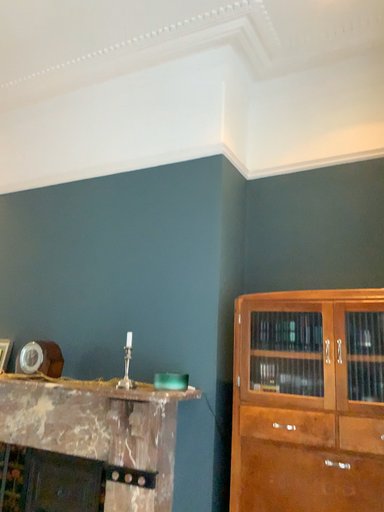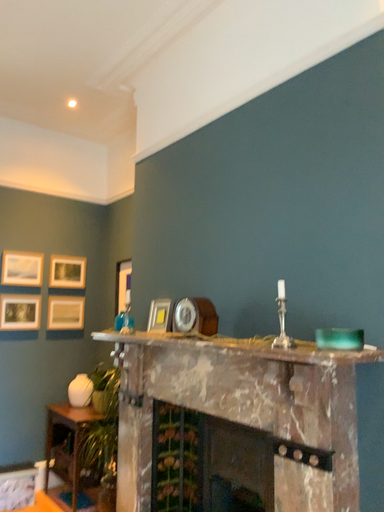
Question: Which way did the camera rotate in the video?

Choices:
 (A) rotated right
 (B) rotated left

Answer: (B)